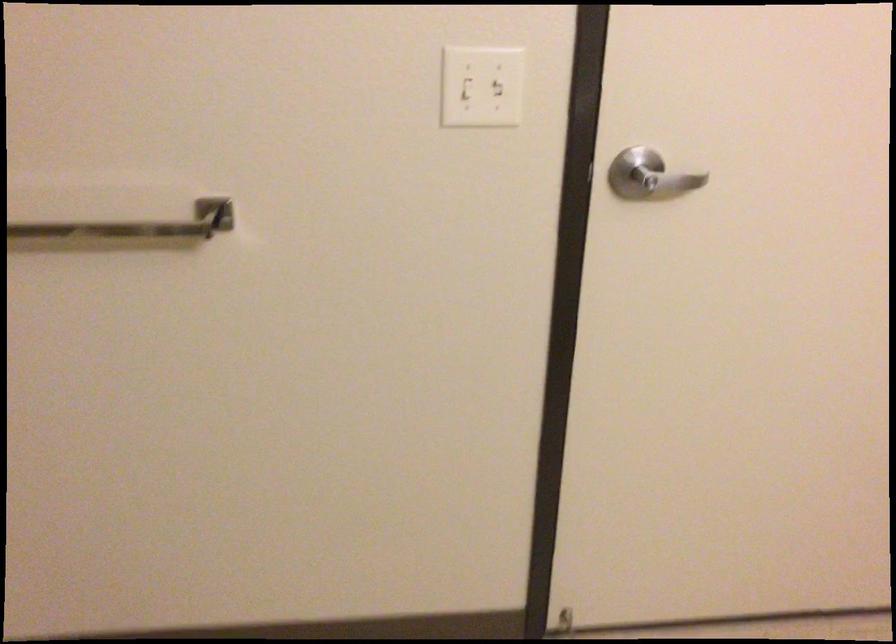
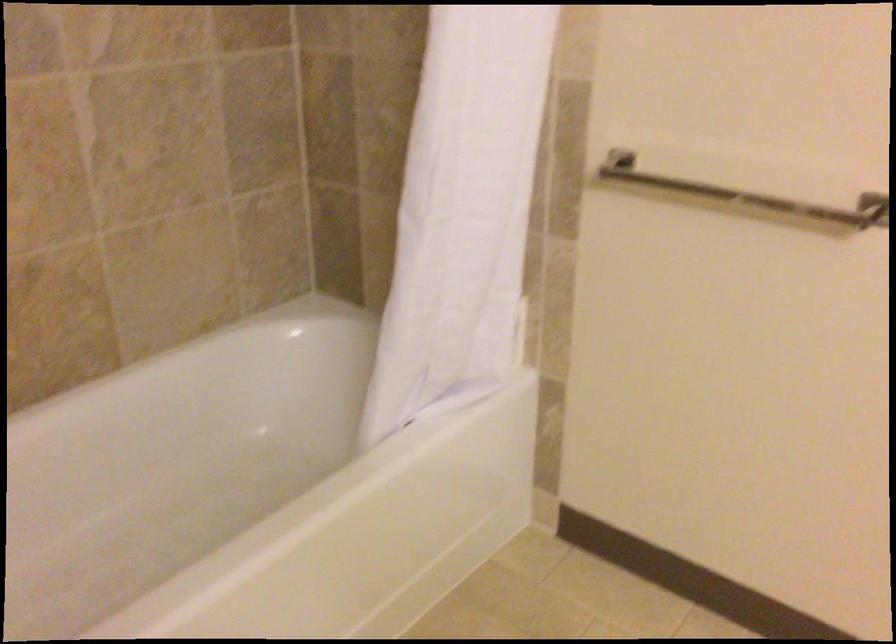
Where in the second image is the point corresponding to the point at 76,220 from the first image?

(745, 194)